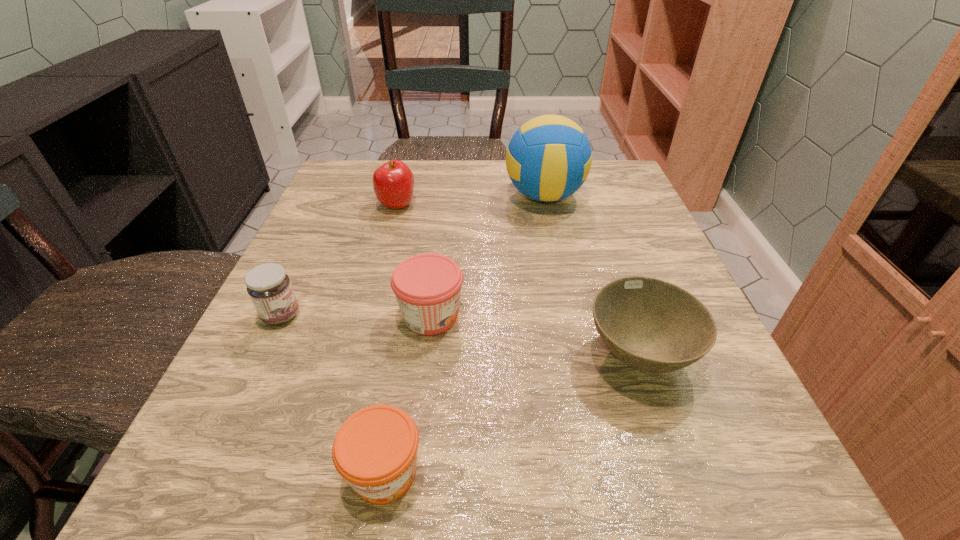
Where is `apple located at the far edge`? The image size is (960, 540). apple located at the far edge is located at coordinates (393, 182).

You are a GUI agent. You are given a task and a screenshot of the screen. Output one action in this format:
    pyautogui.click(x=<x>, y=<y>)
    Task: Click on the object located in the near edge section of the desktop
    The height and width of the screenshot is (540, 960).
    Given the screenshot: What is the action you would take?
    pyautogui.click(x=375, y=450)

Where is `apple present at the left edge`? This screenshot has height=540, width=960. apple present at the left edge is located at coordinates (393, 182).

I want to click on jam that is at the left edge, so click(x=269, y=287).

Find the location of a particular element. The image size is (960, 540). volleyball that is positioned at the right edge is located at coordinates pyautogui.click(x=549, y=157).

Where is `bowl present at the right edge`? bowl present at the right edge is located at coordinates (651, 325).

Where is `object that is at the far left corner`? This screenshot has width=960, height=540. object that is at the far left corner is located at coordinates (393, 182).

This screenshot has height=540, width=960. In order to click on object at the far right corner in this screenshot , I will do `click(549, 157)`.

The image size is (960, 540). In the image, there is a desktop. What are the coordinates of `free space at the far edge` in the screenshot? It's located at (485, 196).

The width and height of the screenshot is (960, 540). In the image, there is a desktop. In order to click on vacant space at the near edge in this screenshot , I will do `click(611, 447)`.